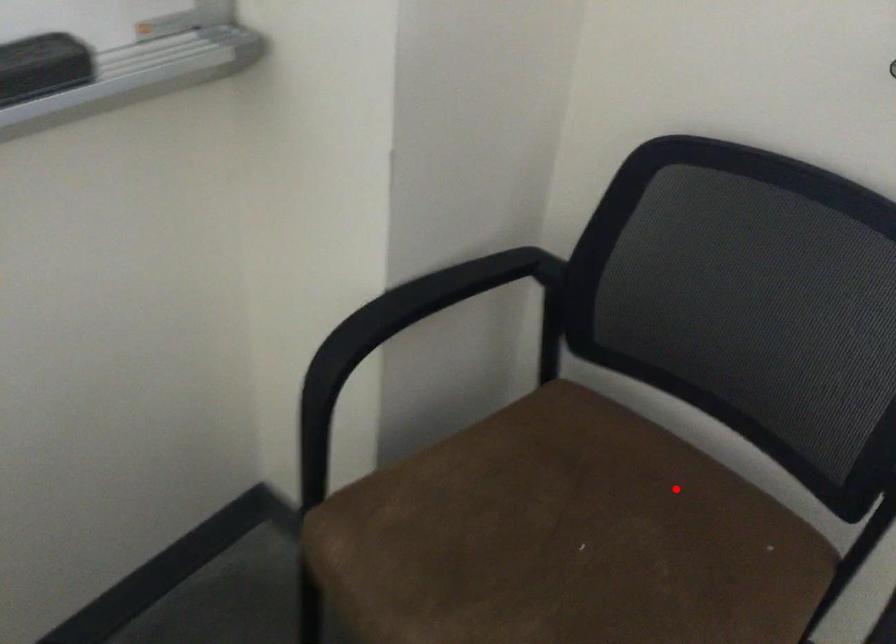
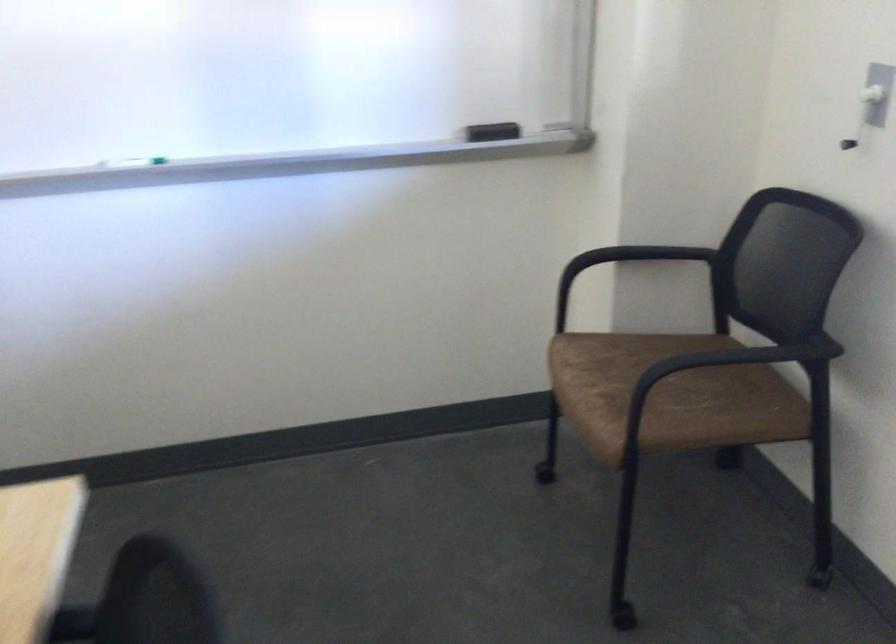
In the second image, find the point that corresponds to the highlighted location in the first image.

(745, 381)